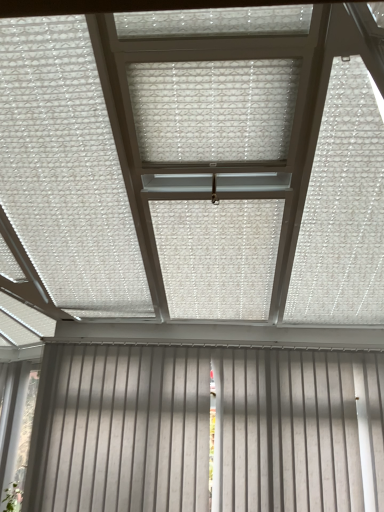
Question: From the image's perspective, is white matte blinds at lower center above or below translucent plastic blind at center?

Choices:
 (A) above
 (B) below

Answer: (B)

Question: Does point (127, 402) appear closer or farther from the camera than point (157, 141)?

Choices:
 (A) closer
 (B) farther

Answer: (B)

Question: Considering the positions of white matte blinds at lower center and translucent plastic blind at center in the image, is white matte blinds at lower center bigger or smaller than translucent plastic blind at center?

Choices:
 (A) big
 (B) small

Answer: (A)

Question: Is point (203, 133) closer or farther from the camera than point (160, 468)?

Choices:
 (A) closer
 (B) farther

Answer: (A)

Question: From the image's perspective, is translucent plastic blind at center positioned above or below white matte blinds at lower center?

Choices:
 (A) above
 (B) below

Answer: (A)

Question: In terms of width, does translucent plastic blind at center look wider or thinner when compared to white matte blinds at lower center?

Choices:
 (A) thin
 (B) wide

Answer: (B)

Question: Is translucent plastic blind at center bigger or smaller than white matte blinds at lower center?

Choices:
 (A) small
 (B) big

Answer: (A)